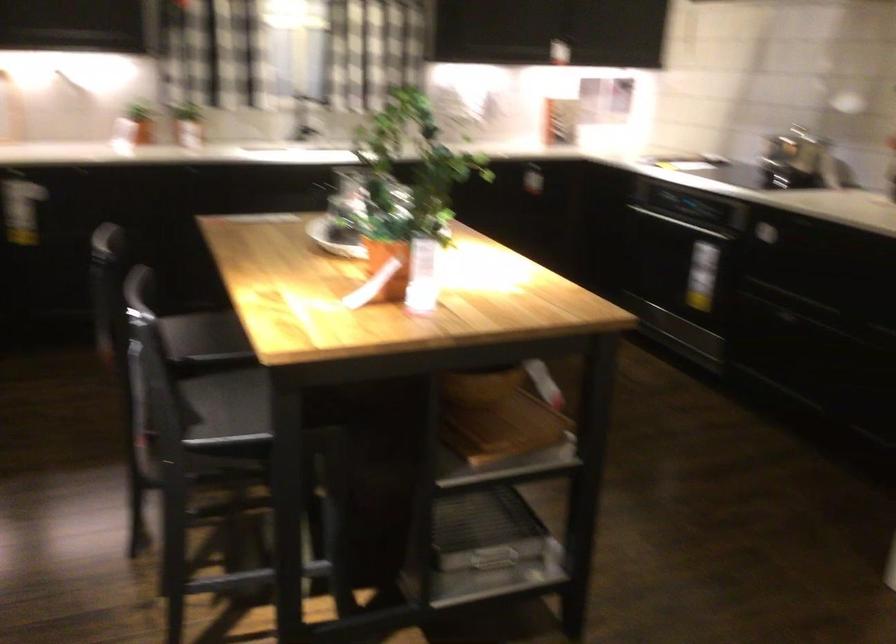
At what (x,y) coordinates should I click in order to perform the action: click on metal kettle. Please return your answer as a coordinate pair (x, y). The height and width of the screenshot is (644, 896). Looking at the image, I should click on (796, 161).